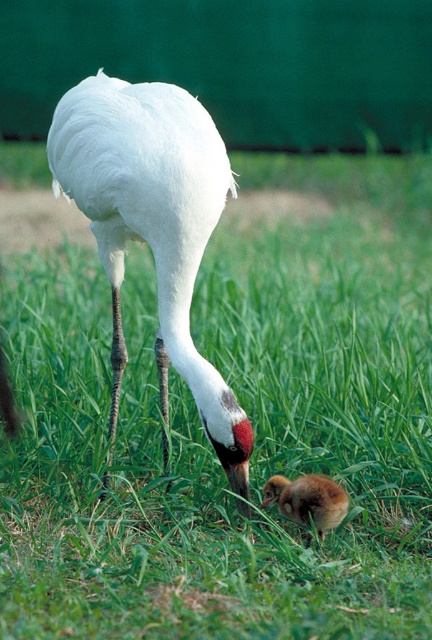
You are a photographer aiming to capture a closeup of the brown fluffy chick at lower center without the white feathered crane at center blocking the shot. Is the crane positioned in a way that it would block the view of the chick?

The white feathered crane at center is located above the brown fluffy chick at lower center, so the crane would block the view of the chick if you try to take a closeup from the current angle.

You are a photographer trying to capture the white feathered crane at center. You notice a point at coordinates [152,225] in the image. Where is this point located relative to the crane?

The point at coordinates [152,225] corresponds to the white feathered crane at center.